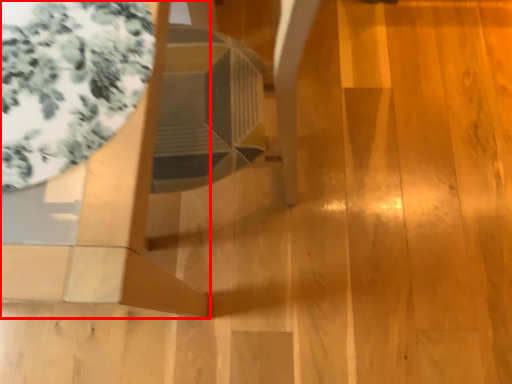
Question: From the image's perspective, where is furniture (annotated by the red box) located in relation to glass table in the image?

Choices:
 (A) above
 (B) below

Answer: (B)